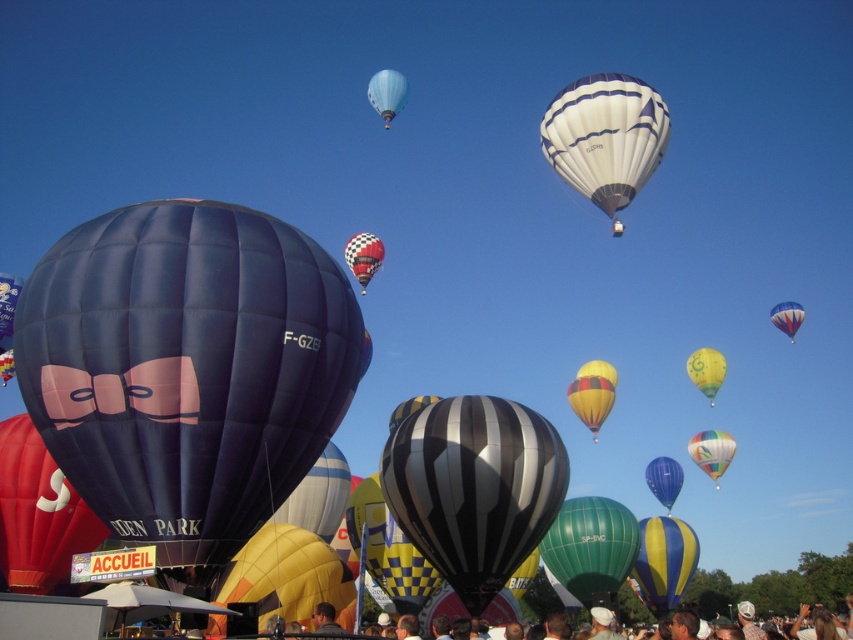
Between yellowcheckered fabricballoon at center and blue glossy balloon at center, which one appears on the left side from the viewer's perspective?

From the viewer's perspective, yellowcheckered fabricballoon at center appears more on the left side.

Which is behind, point (613, 378) or point (670, 490)?

The point (670, 490) is behind.

Find the location of `yellowcheckered fabricballoon at center`. yellowcheckered fabricballoon at center is located at coordinates (592, 394).

Does white striped balloon at upper center have a lesser width compared to yellowcheckered fabricballoon at center?

Correct, white striped balloon at upper center's width is less than yellowcheckered fabricballoon at center's.

Can you confirm if white striped balloon at upper center is smaller than yellowcheckered fabricballoon at center?

Yes.

Identify the location of white striped balloon at upper center. (605, 138).

Find the location of a particular element. This screenshot has height=640, width=853. white striped balloon at upper center is located at coordinates (605, 138).

This screenshot has height=640, width=853. I want to click on yellowcheckered fabricballoon at center, so click(x=592, y=394).

From the picture: Who is lower down, yellowcheckered fabricballoon at center or light blue fabric balloon at upper center?

yellowcheckered fabricballoon at center is below.

The image size is (853, 640). What do you see at coordinates (592, 394) in the screenshot?
I see `yellowcheckered fabricballoon at center` at bounding box center [592, 394].

The height and width of the screenshot is (640, 853). In order to click on yellowcheckered fabricballoon at center in this screenshot , I will do `click(592, 394)`.